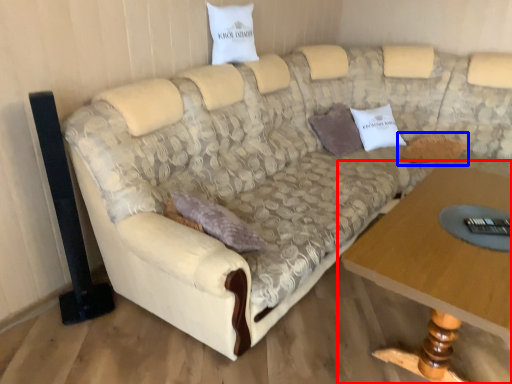
Question: Which point is closer to the camera, table (highlighted by a red box) or pillow (highlighted by a blue box)?

Choices:
 (A) table
 (B) pillow

Answer: (A)